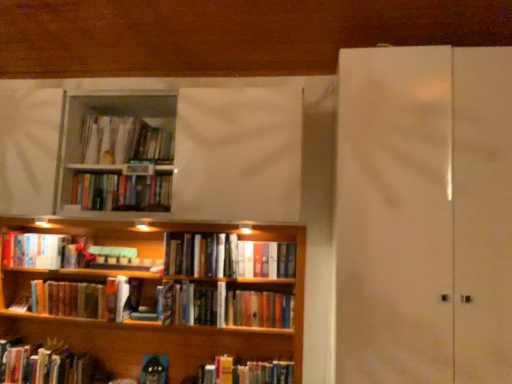
Question: Can you confirm if hardcover book at left, positioned as the third book in top-to-bottom order, is taller than white glossy screen door at right?

Choices:
 (A) no
 (B) yes

Answer: (A)

Question: Is hardcover book at left, positioned as the third book in top-to-bottom order, positioned behind white glossy screen door at right?

Choices:
 (A) no
 (B) yes

Answer: (B)

Question: Is hardcover book at left, positioned as the fifth book in bottom-to-top order, positioned with its back to white glossy screen door at right?

Choices:
 (A) no
 (B) yes

Answer: (A)

Question: Does hardcover book at left, positioned as the fifth book in bottom-to-top order, have a lesser height compared to white glossy screen door at right?

Choices:
 (A) no
 (B) yes

Answer: (B)

Question: Does hardcover book at left, positioned as the fifth book in bottom-to-top order, have a larger size compared to white glossy screen door at right?

Choices:
 (A) no
 (B) yes

Answer: (A)

Question: Can you confirm if hardcover book at left, positioned as the third book in top-to-bottom order, is positioned to the right of white glossy screen door at right?

Choices:
 (A) yes
 (B) no

Answer: (B)

Question: Is hardcover books at lower left, which ranks as the seventh book in top-to-bottom order, taller than hardcover book at lower left, which is the second book in bottom-to-top order?

Choices:
 (A) no
 (B) yes

Answer: (B)

Question: Could you tell me if hardcover books at lower left, which ranks as the seventh book in top-to-bottom order, is facing hardcover book at lower left, which is the second book in bottom-to-top order?

Choices:
 (A) no
 (B) yes

Answer: (A)

Question: Can you confirm if hardcover books at lower left, acting as the 1th book starting from the bottom, is shorter than hardcover book at lower left, which is the second book in bottom-to-top order?

Choices:
 (A) yes
 (B) no

Answer: (B)

Question: From a real-world perspective, is hardcover books at lower left, which ranks as the seventh book in top-to-bottom order, located higher than hardcover book at lower left, which ranks as the 6th book in top-to-bottom order?

Choices:
 (A) yes
 (B) no

Answer: (B)

Question: Is hardcover books at lower left, acting as the 1th book starting from the bottom, with hardcover book at lower left, which ranks as the 6th book in top-to-bottom order?

Choices:
 (A) yes
 (B) no

Answer: (B)

Question: From the image's perspective, is hardcover books at lower left, which ranks as the seventh book in top-to-bottom order, under hardcover book at lower left, which is the second book in bottom-to-top order?

Choices:
 (A) yes
 (B) no

Answer: (A)

Question: Is wooden bookcase at lower left next to hardcover book at lower left, which ranks as the 6th book in top-to-bottom order, and touching it?

Choices:
 (A) no
 (B) yes

Answer: (A)